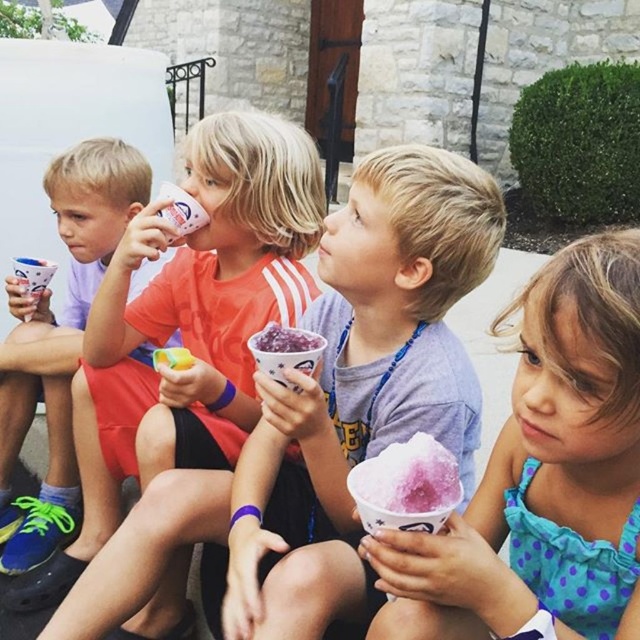
You are a photographer standing at a distance. You want to take a closeup photo of the matte plastic cup at center. The camera you have can focus on objects up to 2 meters away. Can you take the photo without moving closer?

The matte plastic cup at center is 2.52 meters away from the viewer. Since the camera can only focus up to 2 meters, you need to move closer to take the closeup photo.

You are a parent trying to decide which treat to buy for your child. You want the wider one because it holds more. Which one should you choose between the pink frosted snow cone at center and the matte white cup at left?

The matte white cup at left is wider than the pink frosted snow cone at center, so you should choose the matte white cup at left.